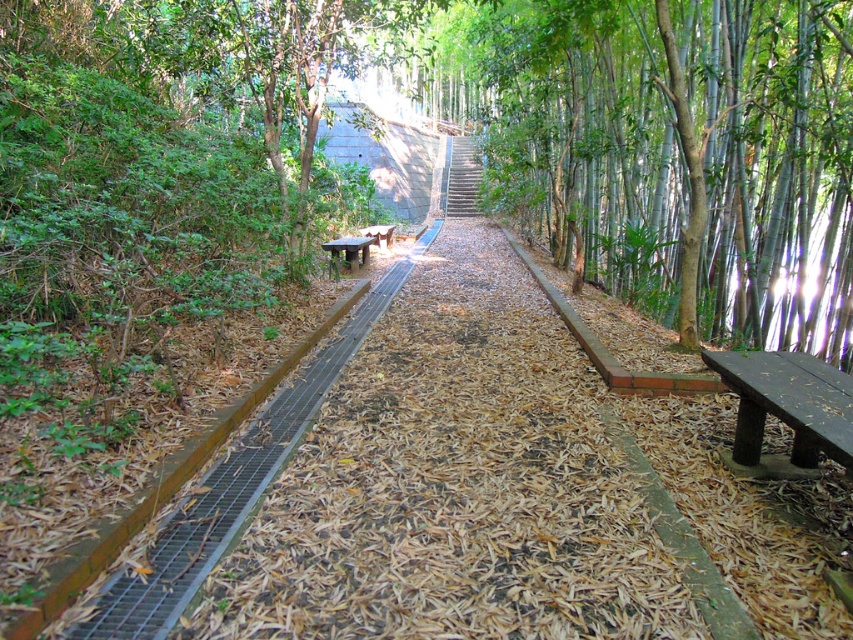
Question: Can you confirm if smooth concrete stairs at center is bigger than brown wooden bench at center?

Choices:
 (A) no
 (B) yes

Answer: (B)

Question: Can you confirm if dark brown wooden bench at right is positioned to the right of brown wooden bench at center?

Choices:
 (A) no
 (B) yes

Answer: (B)

Question: Which point appears farthest from the camera in this image?

Choices:
 (A) (808, 422)
 (B) (477, 164)
 (C) (370, 237)

Answer: (B)

Question: Which object is positioned farthest from the dark brown wooden bench at right?

Choices:
 (A) smooth concrete stairs at center
 (B) wooden bench at center
 (C) brown wooden bench at center

Answer: (A)

Question: Can you confirm if brown wooden bench at center is positioned below wooden bench at center?

Choices:
 (A) no
 (B) yes

Answer: (B)

Question: Based on their relative distances, which object is farther from the wooden bench at center?

Choices:
 (A) brown wooden bench at center
 (B) dark brown wooden bench at right

Answer: (B)